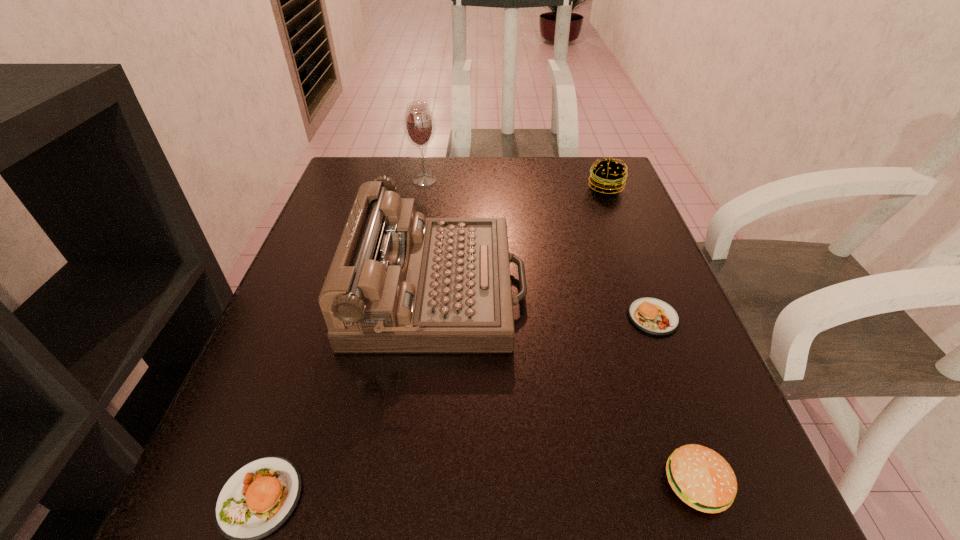
Find the location of a particular element. The height and width of the screenshot is (540, 960). wineglass is located at coordinates (419, 125).

You are a GUI agent. You are given a task and a screenshot of the screen. Output one action in this format:
    pyautogui.click(x=<x>, y=<y>)
    Task: Click on the typewriter
    The width and height of the screenshot is (960, 540).
    Given the screenshot: What is the action you would take?
    pyautogui.click(x=399, y=282)

Image resolution: width=960 pixels, height=540 pixels. In order to click on the tallest patty in this screenshot , I will do [x=607, y=176].

Image resolution: width=960 pixels, height=540 pixels. Identify the location of the farthest patty. point(607,176).

You are a GUI agent. You are given a task and a screenshot of the screen. Output one action in this format:
    pyautogui.click(x=<x>, y=<y>)
    Task: Click on the third nearest patty
    The height and width of the screenshot is (540, 960).
    Given the screenshot: What is the action you would take?
    pyautogui.click(x=653, y=316)

Find the location of a particular element. This screenshot has height=540, width=960. vacant space located 0.370m on the right of the wineglass is located at coordinates (581, 180).

I want to click on free spot located on the keyboard of the typewriter, so click(623, 289).

The image size is (960, 540). What are the coordinates of `vacant area located 0.240m on the left of the tallest patty` in the screenshot? It's located at (493, 187).

I want to click on vacant point located on the left of the third nearest patty, so click(436, 317).

Where is `wineglass that is at the far edge`? This screenshot has width=960, height=540. wineglass that is at the far edge is located at coordinates (419, 125).